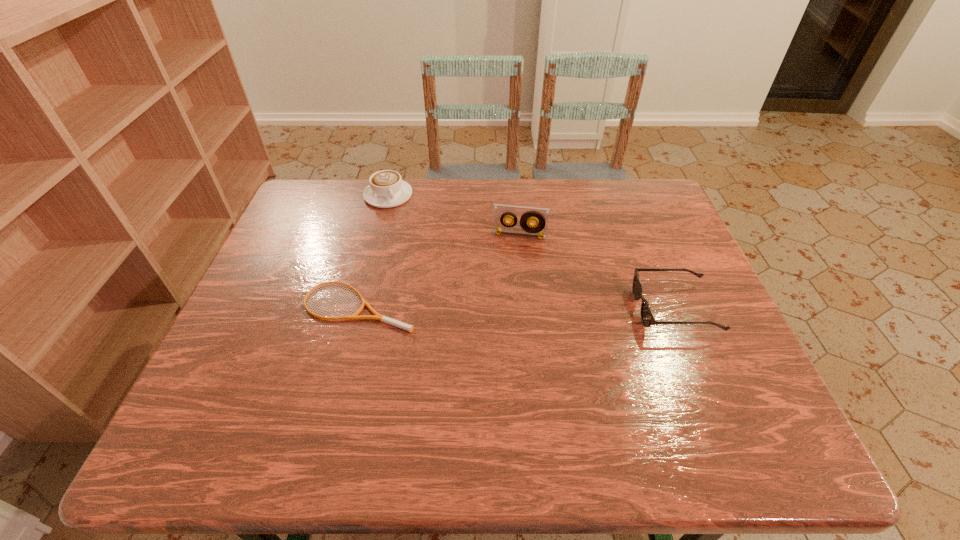
What are the coordinates of `free point between the shortest object and the rightmost object` in the screenshot? It's located at (516, 307).

Find the location of `free spot between the rightmost object and the farthest object`. free spot between the rightmost object and the farthest object is located at coordinates (531, 252).

Identify the location of free space between the third object from left to right and the rightmost object. (597, 272).

Find the location of `vacant region between the tallest object and the cappuccino`. vacant region between the tallest object and the cappuccino is located at coordinates (454, 215).

Find the location of a particular element. object that is the closest to the sunglasses is located at coordinates (540, 216).

Identify which object is the second nearest to the tennis racket. Please provide its 2D coordinates. Your answer should be formatted as a tuple, i.e. [(x, y)], where the tuple contains the x and y coordinates of a point satisfying the conditions above.

[(387, 189)]

This screenshot has width=960, height=540. I want to click on free location that satisfies the following two spatial constraints: 1. on the front side of the rightmost object; 2. on the front lenses of the videotape, so click(x=527, y=309).

Identify the location of free point that satisfies the following two spatial constraints: 1. on the front side of the tennis racket; 2. on the front lenses of the rightmost object. This screenshot has width=960, height=540. (357, 309).

I want to click on vacant region that satisfies the following two spatial constraints: 1. on the front side of the sunglasses; 2. on the front lenses of the videotape, so (527, 309).